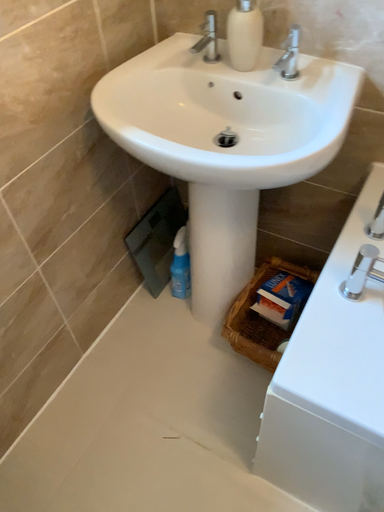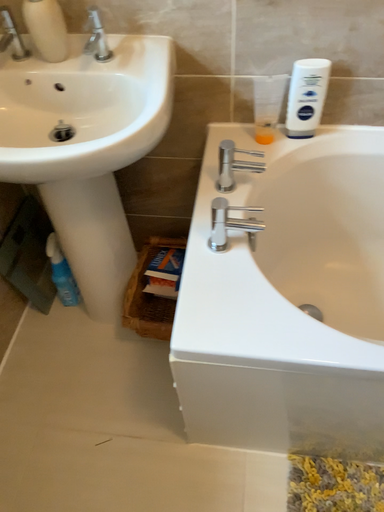
Question: How did the camera likely rotate when shooting the video?

Choices:
 (A) rotated right
 (B) rotated left

Answer: (A)